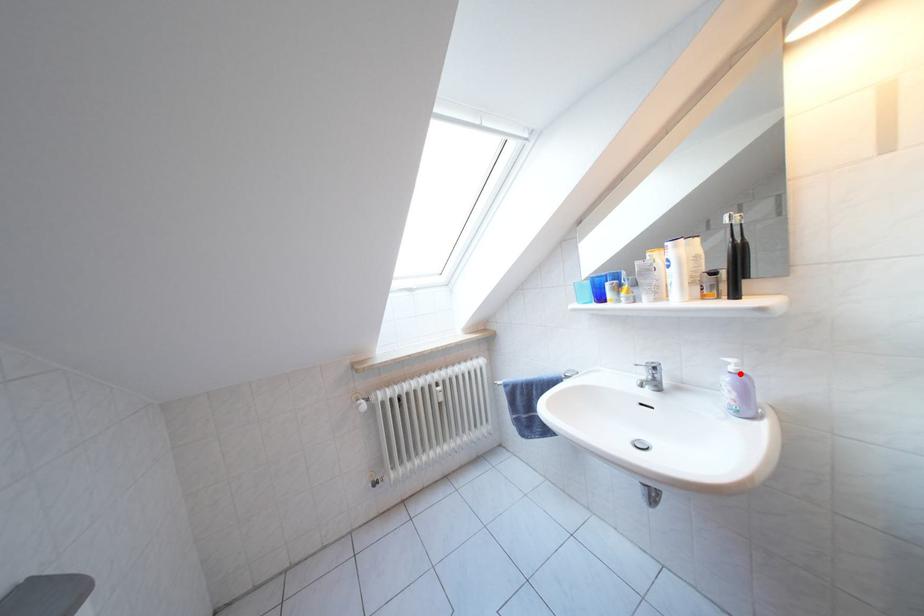
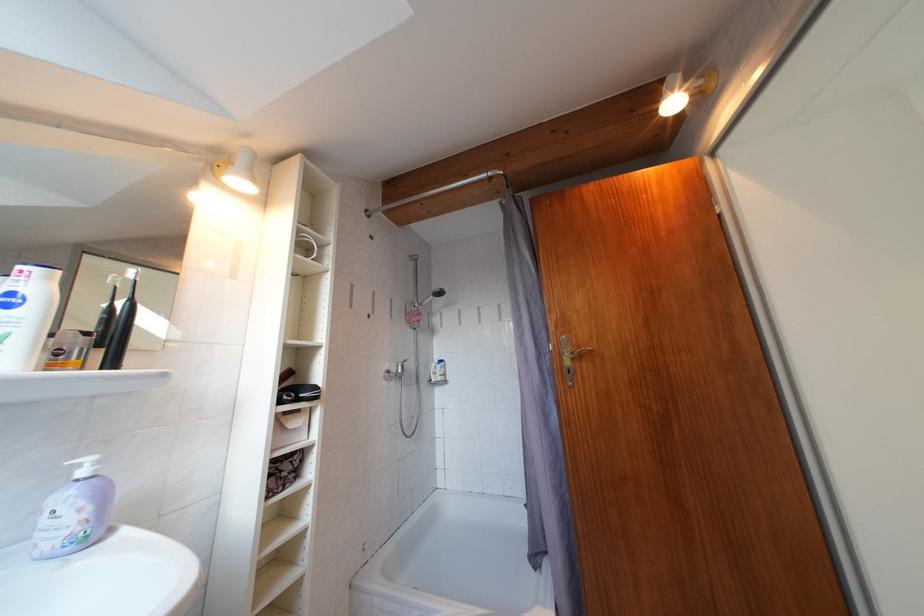
Find the pixel in the second image that matches the highlighted location in the first image.

(92, 477)